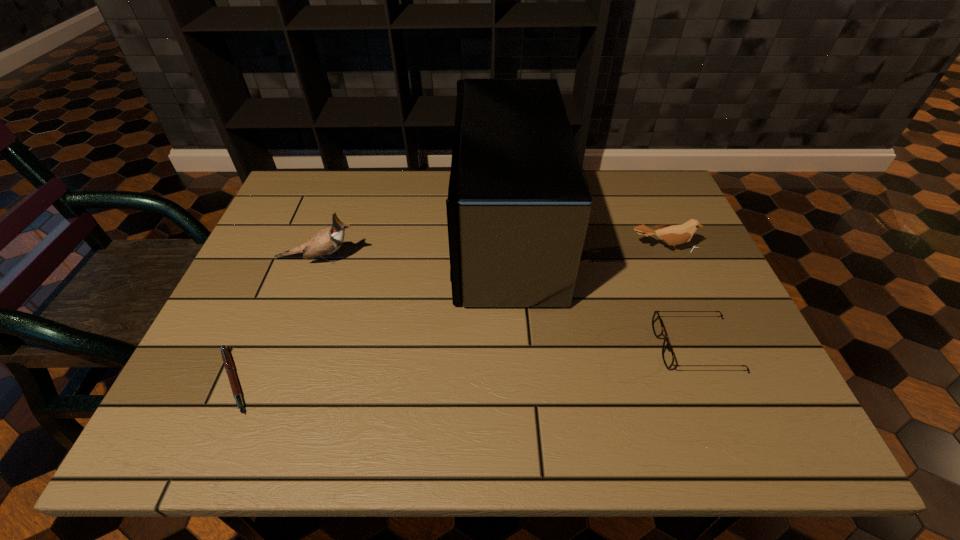
I want to click on empty space between the microwave_oven and the second shortest object, so click(600, 289).

Where is `vacant area that lies between the shorter bird and the fourth tallest object`? Image resolution: width=960 pixels, height=540 pixels. vacant area that lies between the shorter bird and the fourth tallest object is located at coordinates (679, 298).

Locate an element on the screen. free space that is in between the third shortest object and the pen is located at coordinates (448, 314).

Where is `vacant space that is in between the shortest object and the second shortest object`? vacant space that is in between the shortest object and the second shortest object is located at coordinates (465, 363).

Locate an element on the screen. free spot between the left bird and the tallest object is located at coordinates (411, 245).

Identify the location of object that is the second closest to the pen. (518, 207).

Identify which object is the third nearest to the sunglasses. Please provide its 2D coordinates. Your answer should be formatted as a tuple, i.e. [(x, y)], where the tuple contains the x and y coordinates of a point satisfying the conditions above.

[(326, 241)]

The width and height of the screenshot is (960, 540). I want to click on vacant point that satisfies the following two spatial constraints: 1. at the beak of the third shortest object; 2. at the nib of the shortest object, so 719,380.

Identify the location of vacant space that satisfies the following two spatial constraints: 1. at the beak of the right bird; 2. at the face of the fourth shortest object. (667, 259).

I want to click on vacant point that satisfies the following two spatial constraints: 1. at the beak of the third shortest object; 2. at the nib of the shortest object, so click(719, 380).